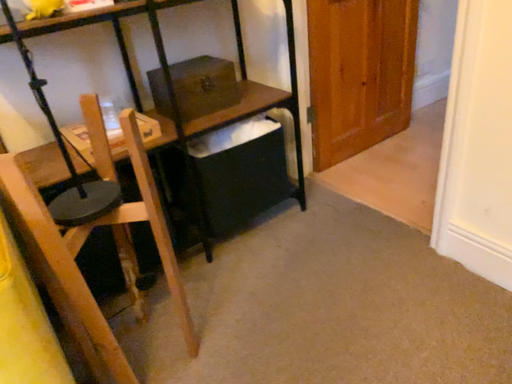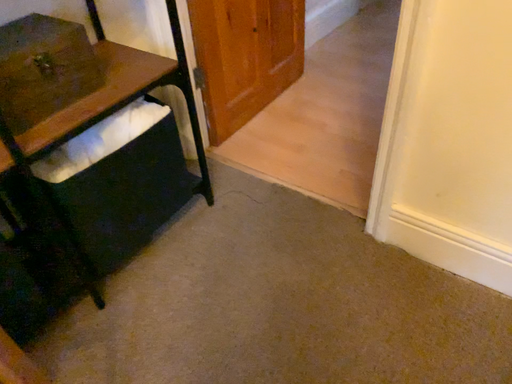
Question: Which way did the camera rotate in the video?

Choices:
 (A) rotated right
 (B) rotated left

Answer: (A)